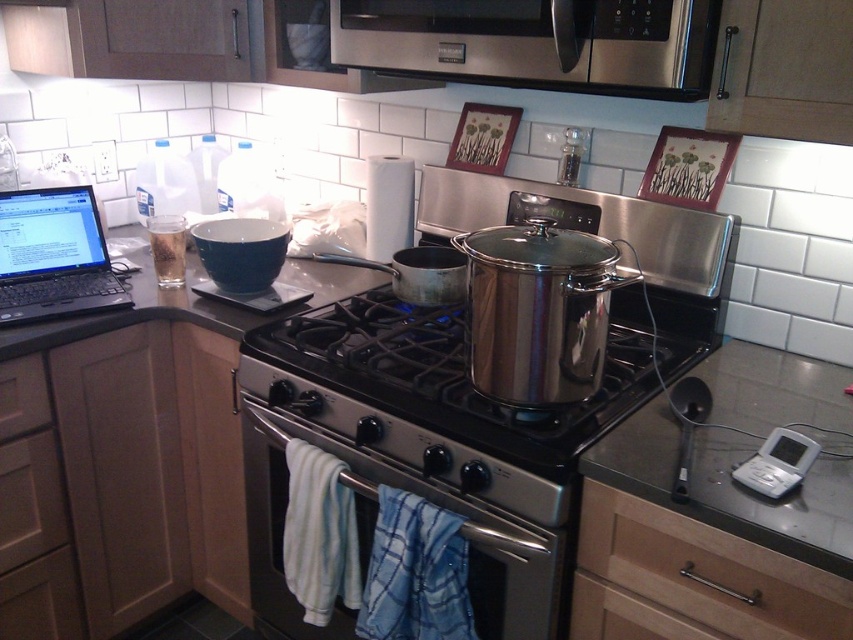
Question: Among these points, which one is farthest from the camera?

Choices:
 (A) (663, 33)
 (B) (62, 256)
 (C) (374, 520)
 (D) (236, 588)

Answer: (D)

Question: Based on their relative distances, which object is farther from the wooden drawer at lower right?

Choices:
 (A) smooth granite countertop at center
 (B) stainless steel oven at center
 (C) stainless steel gas stove at center

Answer: (A)

Question: Does wooden drawer at lower right have a smaller size compared to black matte laptop at upper left?

Choices:
 (A) no
 (B) yes

Answer: (B)

Question: Can you confirm if smooth granite countertop at center is smaller than stainless steel oven at center?

Choices:
 (A) no
 (B) yes

Answer: (A)

Question: Among these points, which one is nearest to the camera?

Choices:
 (A) (820, 424)
 (B) (329, 336)

Answer: (A)

Question: Can you confirm if wooden drawer at lower right is positioned above stainless steel oven at center?

Choices:
 (A) no
 (B) yes

Answer: (B)